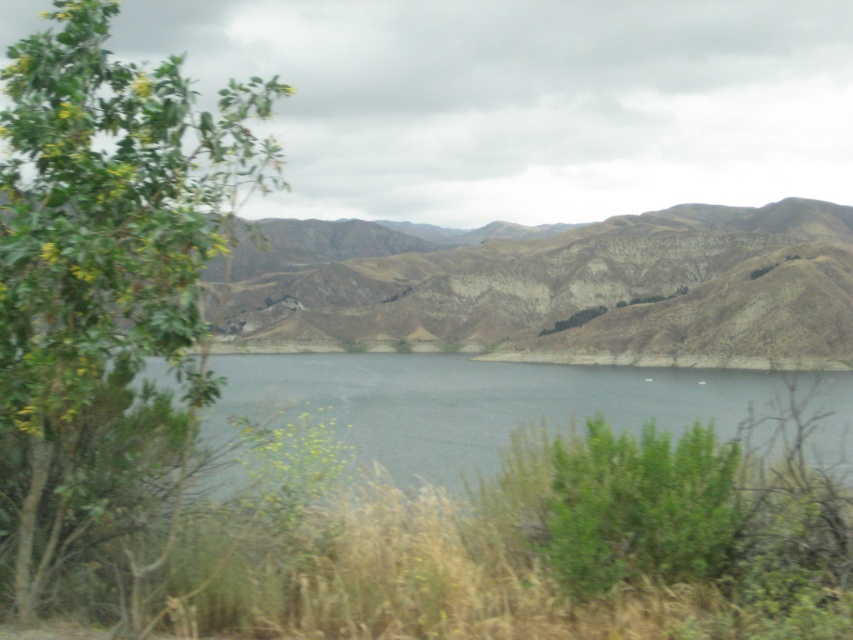
Question: Which object is positioned closest to the brown textured mountain at center?

Choices:
 (A) green leafy tree at left
 (B) clear water at center

Answer: (B)

Question: Is brown textured mountain at center to the left of clear water at center from the viewer's perspective?

Choices:
 (A) no
 (B) yes

Answer: (B)

Question: Which point is closer to the camera?

Choices:
 (A) tap(363, 371)
 (B) tap(73, 214)

Answer: (B)

Question: Does green leafy tree at left have a larger size compared to clear water at center?

Choices:
 (A) no
 (B) yes

Answer: (A)

Question: Among these objects, which one is farthest from the camera?

Choices:
 (A) green leafy tree at left
 (B) clear water at center
 (C) brown textured mountain at center

Answer: (B)

Question: Can you confirm if green leafy tree at left is wider than brown textured mountain at center?

Choices:
 (A) yes
 (B) no

Answer: (B)